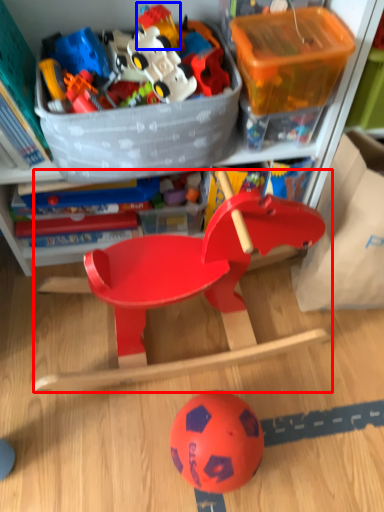
Question: Which object appears closest to the camera in this image, toy (highlighted by a red box) or toy (highlighted by a blue box)?

Choices:
 (A) toy
 (B) toy

Answer: (A)